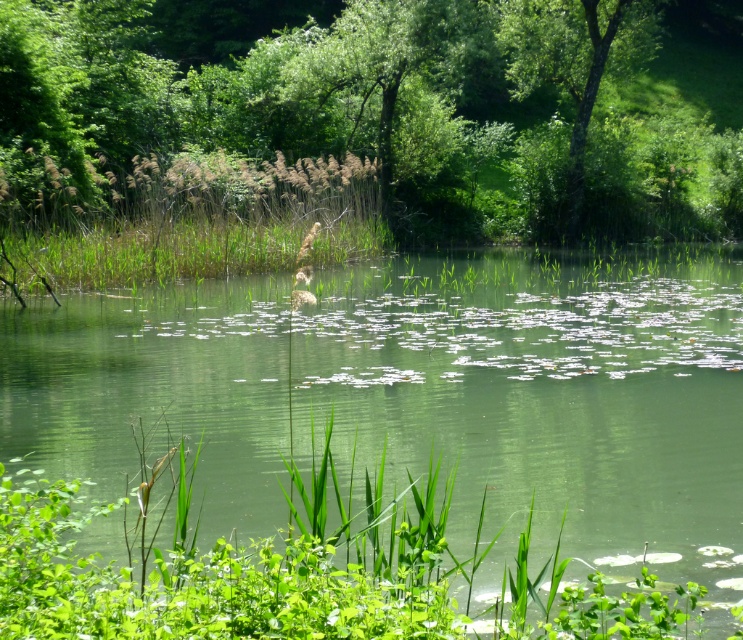
Question: Among these objects, which one is farthest from the camera?

Choices:
 (A) green leafy tree at upper right
 (B) green leafy grass at center
 (C) green leafy vegetation at center

Answer: (A)

Question: From the image, what is the correct spatial relationship of green leafy tree at upper center in relation to green leafy tree at upper right?

Choices:
 (A) left
 (B) right

Answer: (A)

Question: Which point is farther to the camera?

Choices:
 (A) (62, 285)
 (B) (519, 19)

Answer: (B)

Question: Is green leafy grass at center thinner than green leafy tree at upper right?

Choices:
 (A) yes
 (B) no

Answer: (B)

Question: Is the position of green leafy tree at upper center less distant than that of green leafy tree at upper right?

Choices:
 (A) yes
 (B) no

Answer: (A)

Question: Which of the following is the closest to the observer?

Choices:
 (A) click(x=314, y=257)
 (B) click(x=626, y=61)

Answer: (A)